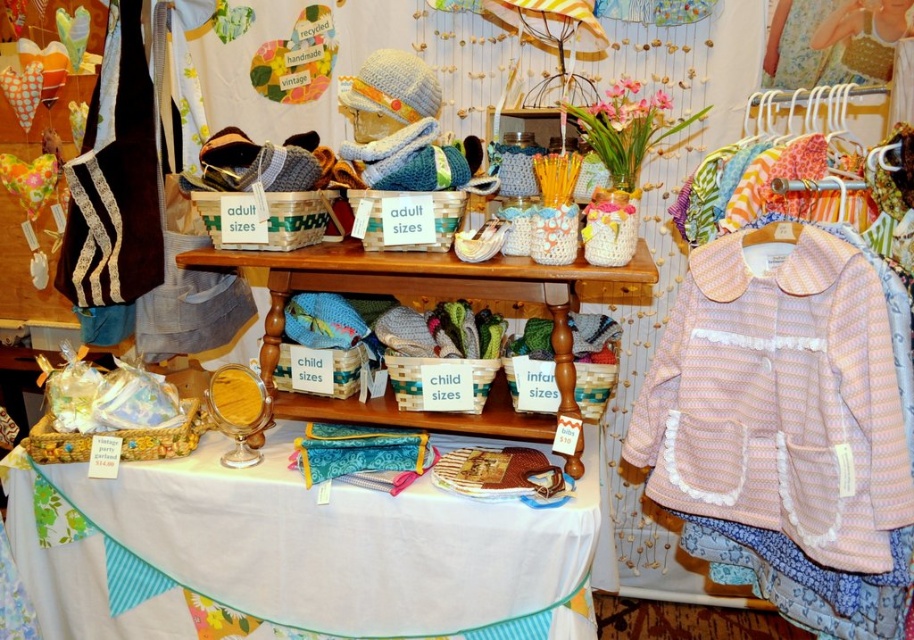
Is brown velvet bag at left above floral fabric dress at upper right?

No, brown velvet bag at left is not above floral fabric dress at upper right.

Between point (124, 177) and point (785, 52), which one is positioned behind?

The point (785, 52) is more distant.

Between point (112, 212) and point (779, 72), which one is positioned behind?

The point (779, 72) is behind.

Image resolution: width=914 pixels, height=640 pixels. In order to click on brown velvet bag at left in this screenshot , I will do (115, 179).

Does wooden table at center come in front of floral fabric dress at upper right?

Yes, wooden table at center is in front of floral fabric dress at upper right.

Does wooden table at center lie behind floral fabric dress at upper right?

No, it is not.

Does point (357, 248) lie in front of point (777, 52)?

Yes, point (357, 248) is closer to viewer.

Locate an element on the screen. wooden table at center is located at coordinates (424, 300).

Image resolution: width=914 pixels, height=640 pixels. What do you see at coordinates (780, 401) in the screenshot? I see `pink striped fabric jacket at center` at bounding box center [780, 401].

Can you confirm if pink striped fabric jacket at center is bigger than teal fabric pouch at center?

Correct, pink striped fabric jacket at center is larger in size than teal fabric pouch at center.

Is point (736, 248) farther from camera compared to point (409, 452)?

No.

Identify the location of pink striped fabric jacket at center. This screenshot has width=914, height=640. (780, 401).